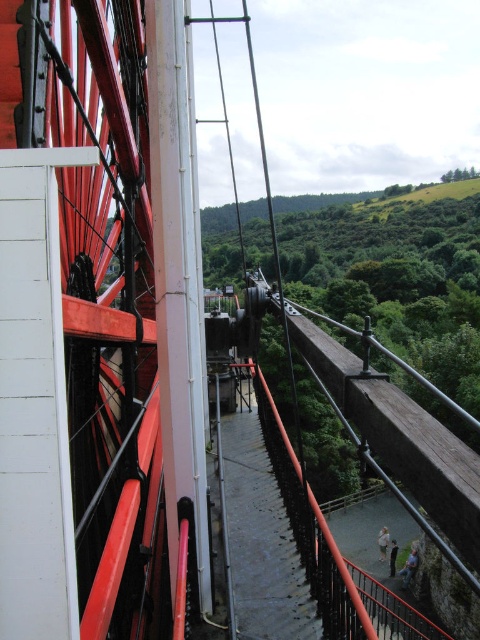
Question: Among these objects, which one is farthest from the camera?

Choices:
 (A) light beige fabric at lower center
 (B) light brown leather jacket at center

Answer: (A)

Question: Is light beige fabric at lower center wider than dark gray fabric at lower center?

Choices:
 (A) no
 (B) yes

Answer: (B)

Question: Does light brown leather jacket at center appear under light beige fabric at lower center?

Choices:
 (A) no
 (B) yes

Answer: (A)

Question: Can you confirm if light brown leather jacket at center is positioned below dark gray fabric at lower center?

Choices:
 (A) yes
 (B) no

Answer: (B)

Question: Among these points, which one is farthest from the camera?

Choices:
 (A) (409, 560)
 (B) (396, 554)
 (C) (377, 540)

Answer: (C)

Question: Estimate the real-world distances between objects in this image. Which object is farther from the dark gray fabric at lower center?

Choices:
 (A) light beige fabric at lower center
 (B) light brown leather jacket at center

Answer: (A)